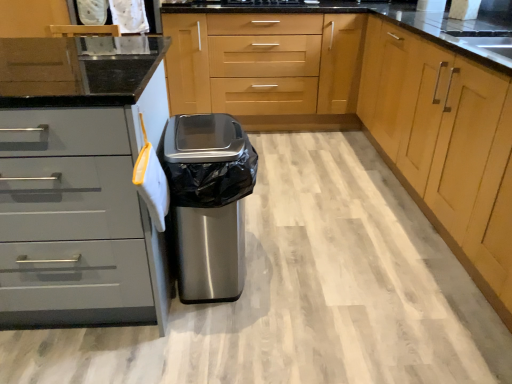
Question: Is matte gray drawers at left, arranged as the first cabinetry when viewed from the left, with light wood cabinet at center, which appears as the first cabinetry when viewed from the right?

Choices:
 (A) no
 (B) yes

Answer: (A)

Question: Is matte gray drawers at left, arranged as the first cabinetry when viewed from the left, located outside light wood cabinet at center, which appears as the first cabinetry when viewed from the right?

Choices:
 (A) yes
 (B) no

Answer: (A)

Question: Is matte gray drawers at left, arranged as the first cabinetry when viewed from the left, to the right of light wood cabinet at center, which appears as the first cabinetry when viewed from the right, from the viewer's perspective?

Choices:
 (A) yes
 (B) no

Answer: (B)

Question: Is matte gray drawers at left, arranged as the first cabinetry when viewed from the left, oriented towards light wood cabinet at center, placed as the 4th cabinetry when sorted from left to right?

Choices:
 (A) yes
 (B) no

Answer: (B)

Question: Can you confirm if matte gray drawers at left, arranged as the first cabinetry when viewed from the left, is wider than light wood cabinet at center, which appears as the first cabinetry when viewed from the right?

Choices:
 (A) no
 (B) yes

Answer: (B)

Question: Do you think light wood cabinet at center, placed as the 4th cabinetry when sorted from left to right, is within matte gray drawers at left, arranged as the first cabinetry when viewed from the left, or outside of it?

Choices:
 (A) inside
 (B) outside

Answer: (B)

Question: Considering the positions of point (433, 71) and point (59, 97), is point (433, 71) closer or farther from the camera than point (59, 97)?

Choices:
 (A) farther
 (B) closer

Answer: (A)

Question: From the image's perspective, relative to matte gray drawers at left, which is the 4th cabinetry from right to left, is light wood cabinet at center, which appears as the first cabinetry when viewed from the right, above or below?

Choices:
 (A) below
 (B) above

Answer: (B)

Question: From their relative heights in the image, would you say light wood cabinet at center, placed as the 4th cabinetry when sorted from left to right, is taller or shorter than matte gray drawers at left, arranged as the first cabinetry when viewed from the left?

Choices:
 (A) short
 (B) tall

Answer: (A)

Question: Visually, is light wood cabinet at center, the third cabinetry positioned from the right, positioned to the left or to the right of brushed metal cabinet at center, which ranks as the second cabinetry in right-to-left order?

Choices:
 (A) left
 (B) right

Answer: (A)

Question: Looking at the image, does light wood cabinet at center, the third cabinetry positioned from the right, seem bigger or smaller compared to brushed metal cabinet at center, marked as the third cabinetry in a left-to-right arrangement?

Choices:
 (A) small
 (B) big

Answer: (A)

Question: Is light wood cabinet at center, which is the second cabinetry from left to right, in front of or behind brushed metal cabinet at center, marked as the third cabinetry in a left-to-right arrangement, in the image?

Choices:
 (A) behind
 (B) front

Answer: (A)

Question: From a real-world perspective, is light wood cabinet at center, which is the second cabinetry from left to right, physically located above or below brushed metal cabinet at center, which ranks as the second cabinetry in right-to-left order?

Choices:
 (A) below
 (B) above

Answer: (A)

Question: From the image's perspective, relative to light wood cabinet at center, which appears as the first cabinetry when viewed from the right, is brushed metal cabinet at center, which ranks as the second cabinetry in right-to-left order, above or below?

Choices:
 (A) below
 (B) above

Answer: (B)

Question: Is brushed metal cabinet at center, which ranks as the second cabinetry in right-to-left order, wider or thinner than light wood cabinet at center, which appears as the first cabinetry when viewed from the right?

Choices:
 (A) thin
 (B) wide

Answer: (B)